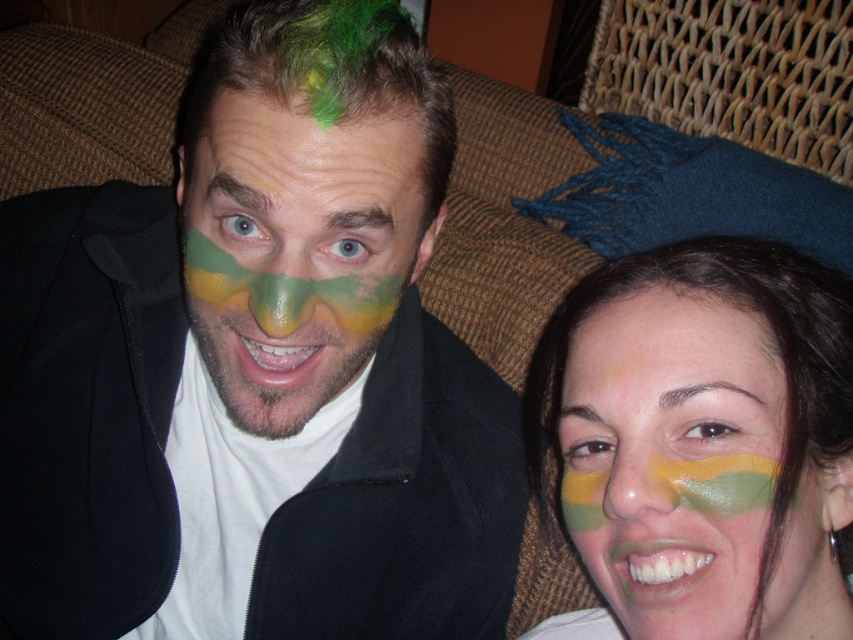
Question: Estimate the real-world distances between objects in this image. Which object is farther from the green matte paint at lower right?

Choices:
 (A) matte black jacket at center
 (B) green matte paint at center

Answer: (A)

Question: Does matte black jacket at center have a greater width compared to green matte paint at lower right?

Choices:
 (A) yes
 (B) no

Answer: (A)

Question: Can you confirm if matte black jacket at center is smaller than green matte paint at lower right?

Choices:
 (A) no
 (B) yes

Answer: (A)

Question: Considering the real-world distances, which object is closest to the matte black jacket at center?

Choices:
 (A) green matte paint at lower right
 (B) green matte paint at center

Answer: (B)

Question: Which point is closer to the camera taking this photo?

Choices:
 (A) (x=722, y=406)
 (B) (x=387, y=298)

Answer: (A)

Question: Does green matte paint at lower right have a smaller size compared to green matte paint at center?

Choices:
 (A) yes
 (B) no

Answer: (A)